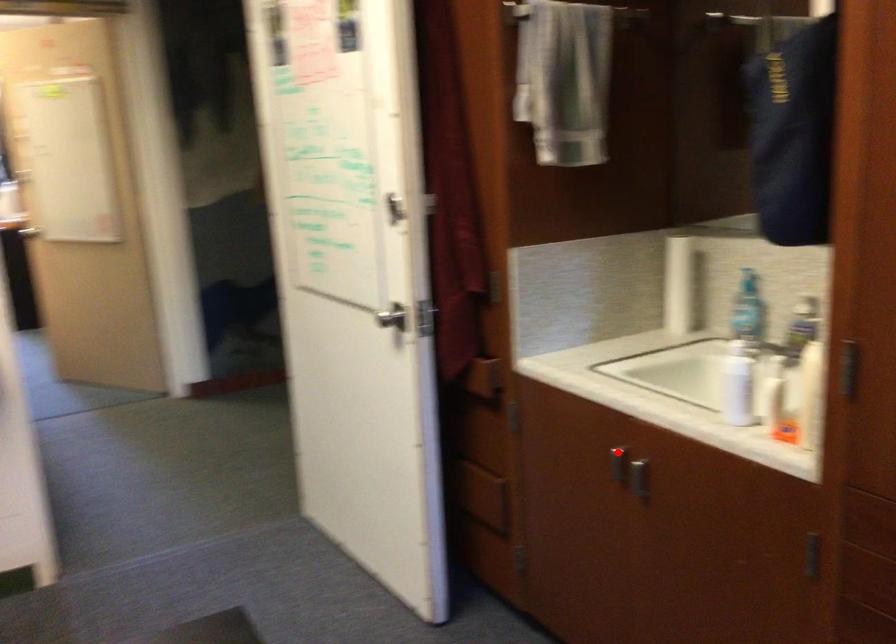
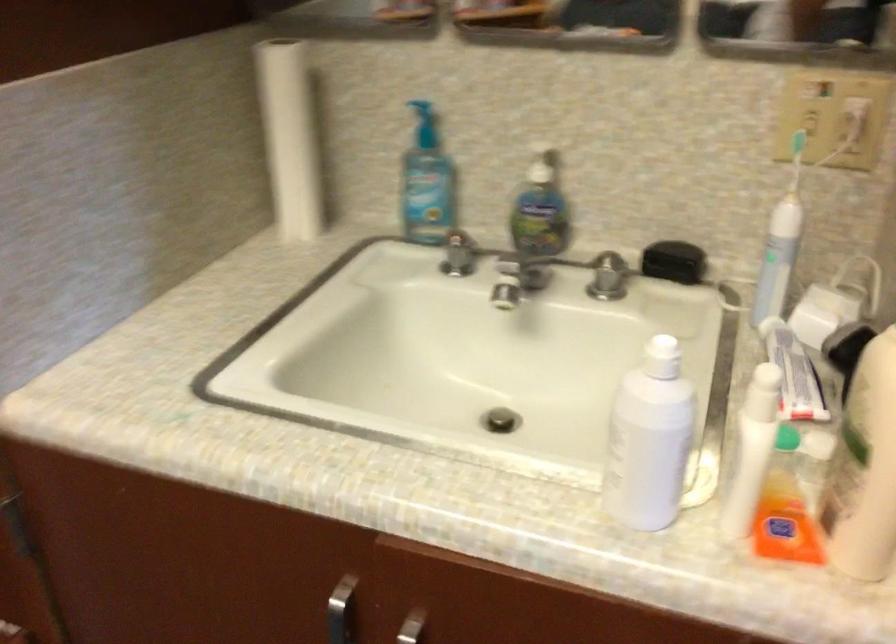
Question: I am providing you with two images of the same scene from different viewpoints. Image1 has a red point marked. In image2, the corresponding 3D location appears at what relative position? Reply with the corresponding letter.

Choices:
 (A) Closer
 (B) Farther

Answer: (A)